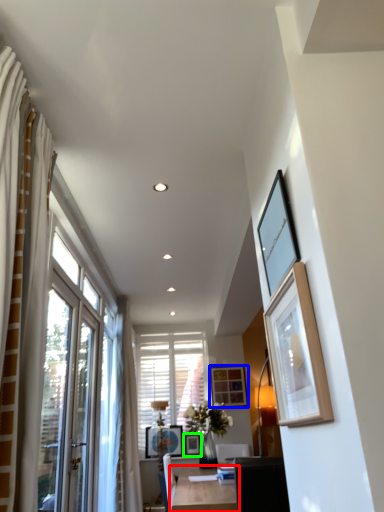
Question: Which is farther away from table (highlighted by a red box)? picture frame (highlighted by a blue box) or picture frame (highlighted by a green box)?

Choices:
 (A) picture frame
 (B) picture frame

Answer: (A)